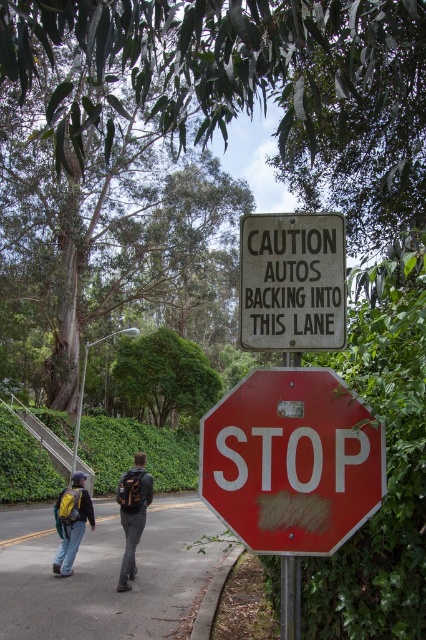
Question: Which point is farther from the camera taking this photo?

Choices:
 (A) (40, 464)
 (B) (250, 333)

Answer: (A)

Question: Among these objects, which one is farthest from the camera?

Choices:
 (A) gray asphalt pavement at lower center
 (B) yellow backpack at left
 (C) green leafy hedge at lower center
 (D) smooth red stop sign at center

Answer: (C)

Question: Is gray asphalt pavement at lower center in front of green leafy hedge at upper center?

Choices:
 (A) yes
 (B) no

Answer: (A)

Question: Is the position of black backpack at center more distant than that of yellow backpack at left?

Choices:
 (A) yes
 (B) no

Answer: (B)

Question: Based on their relative distances, which object is nearer to the smooth red stop sign at center?

Choices:
 (A) gray asphalt pavement at lower center
 (B) yellow backpack at left

Answer: (B)

Question: Is smooth red stop sign at center to the left of green leafy hedge at lower center from the viewer's perspective?

Choices:
 (A) no
 (B) yes

Answer: (A)